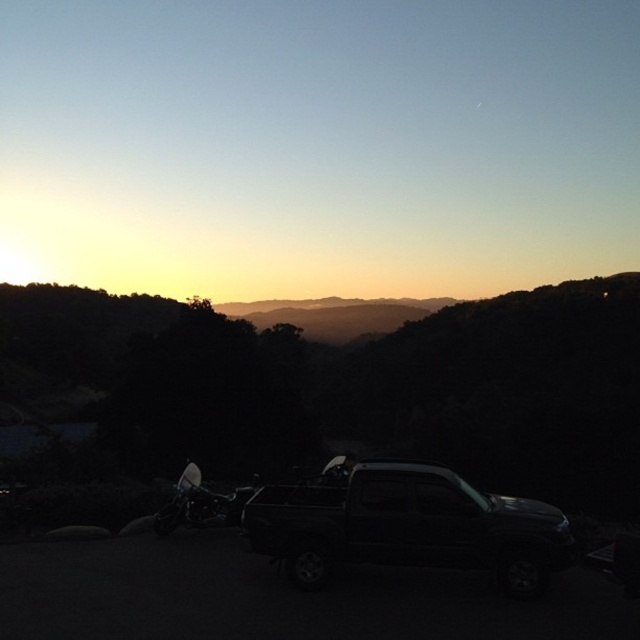
Between black matte truck at center and shiny black motorcycle at lower left, which one has less height?

With less height is black matte truck at center.

Which is more to the right, black matte truck at center or shiny black motorcycle at lower left?

Positioned to the right is black matte truck at center.

Who is more distant from viewer, [522,560] or [230,522]?

The point [230,522] is behind.

At what (x,y) coordinates should I click in order to perform the action: click on black matte truck at center. Please return your answer as a coordinate pair (x, y). This screenshot has width=640, height=640. Looking at the image, I should click on (406, 525).